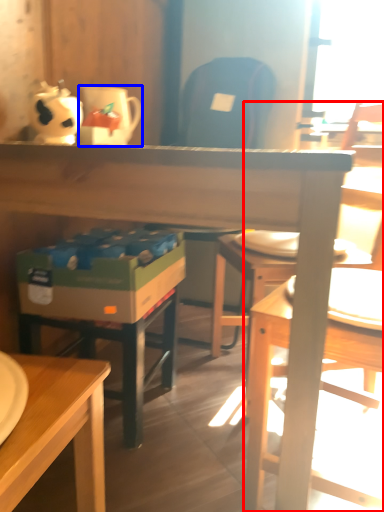
Question: Which object appears closest to the camera in this image, chair (highlighted by a red box) or coffee cup (highlighted by a blue box)?

Choices:
 (A) chair
 (B) coffee cup

Answer: (A)